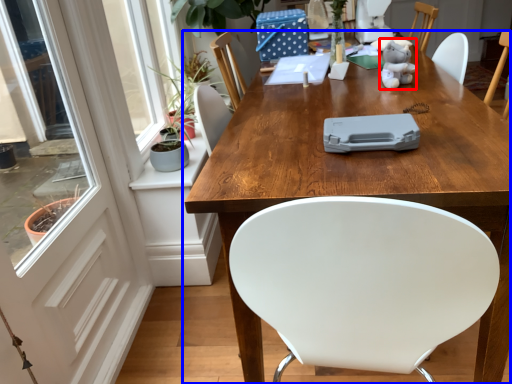
Question: Among these objects, which one is farthest to the camera, toy (highlighted by a red box) or table (highlighted by a blue box)?

Choices:
 (A) toy
 (B) table

Answer: (A)